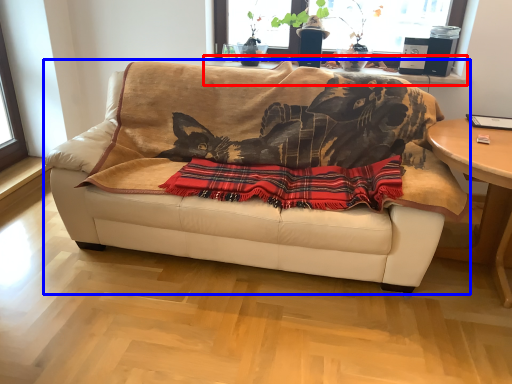
Question: Which of the following is the closest to the observer, window sill (highlighted by a red box) or studio couch (highlighted by a blue box)?

Choices:
 (A) window sill
 (B) studio couch

Answer: (B)